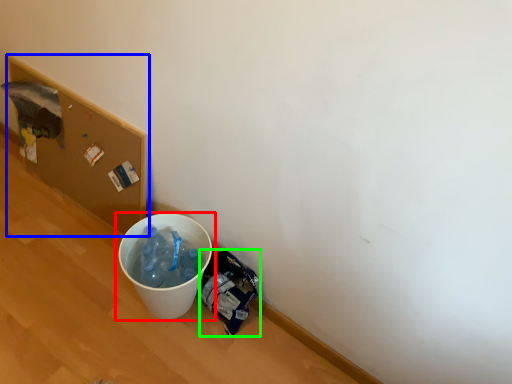
Question: Which is farther away from waste container (highlighted by a red box)? cardboard box (highlighted by a blue box) or garbage (highlighted by a green box)?

Choices:
 (A) cardboard box
 (B) garbage

Answer: (A)